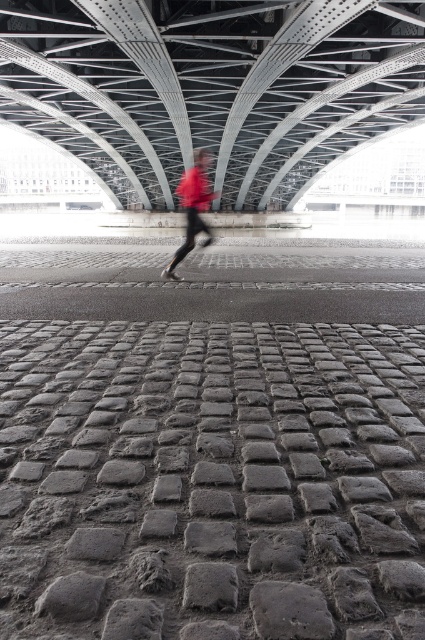
Question: Can you confirm if gray cobblestone pavement at center is thinner than metallic gray bridge at center?

Choices:
 (A) yes
 (B) no

Answer: (A)

Question: Based on their relative distances, which object is nearer to the red fabric pants at center?

Choices:
 (A) metallic gray bridge at center
 (B) gray cobblestone pavement at center

Answer: (A)

Question: Is metallic gray bridge at center wider than red fabric pants at center?

Choices:
 (A) yes
 (B) no

Answer: (A)

Question: Which object appears closest to the camera in this image?

Choices:
 (A) metallic gray bridge at center
 (B) red fabric pants at center
 (C) gray cobblestone pavement at center

Answer: (C)

Question: Is metallic gray bridge at center below red fabric pants at center?

Choices:
 (A) yes
 (B) no

Answer: (B)

Question: Among these points, which one is farthest from the camera?

Choices:
 (A) (280, 81)
 (B) (193, 211)

Answer: (A)